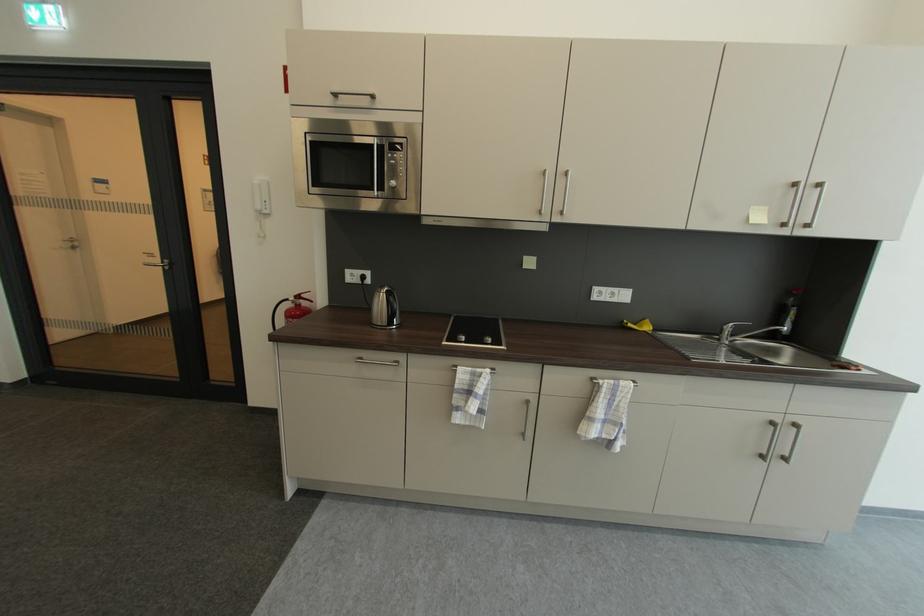
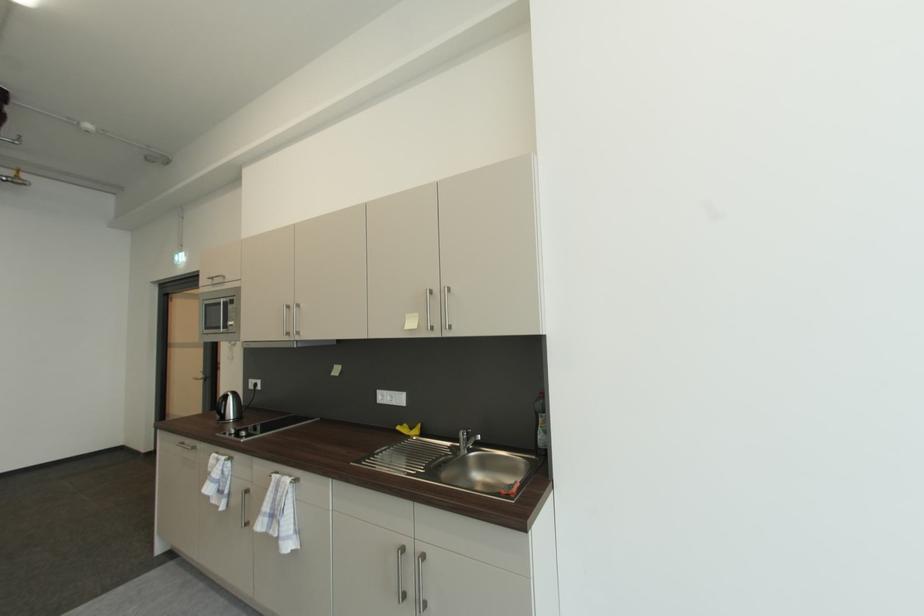
Find the pixel in the second image that matches point (629, 323) in the first image.

(408, 427)